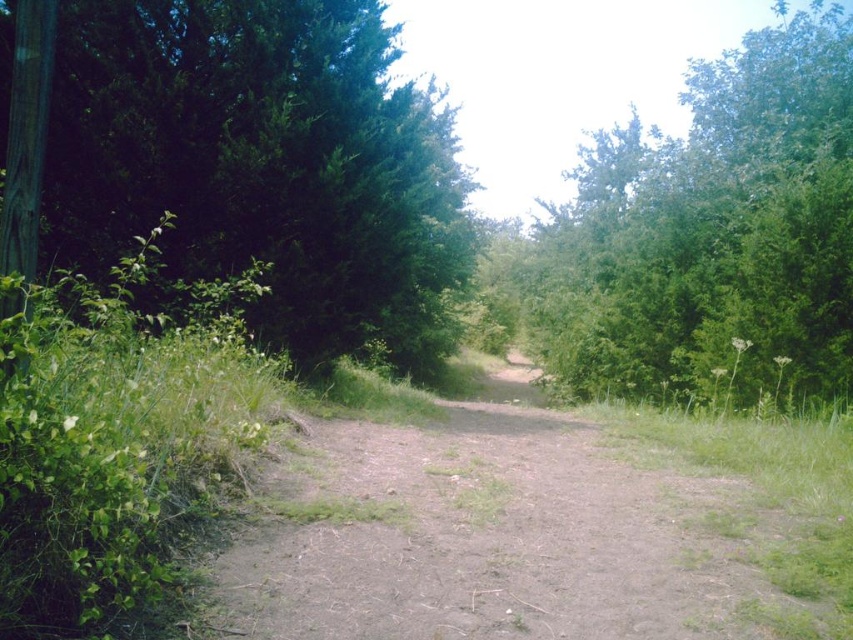
Question: Which object appears closest to the camera in this image?

Choices:
 (A) green leafy tree at upper right
 (B) green leafy tree at left
 (C) brown dirt track at center

Answer: (B)

Question: In this image, where is brown dirt track at center located relative to green leafy tree at upper right?

Choices:
 (A) right
 (B) left

Answer: (B)

Question: Among these points, which one is nearest to the camera?

Choices:
 (A) coord(822,120)
 (B) coord(395,589)
 (C) coord(125,96)

Answer: (B)

Question: Which of the following is the farthest from the observer?

Choices:
 (A) green leafy tree at upper right
 (B) green leafy tree at left

Answer: (A)

Question: Can you confirm if brown dirt track at center is bigger than green leafy tree at upper right?

Choices:
 (A) no
 (B) yes

Answer: (A)

Question: Observing the image, what is the correct spatial positioning of green leafy tree at left in reference to green leafy tree at upper right?

Choices:
 (A) above
 (B) below

Answer: (B)